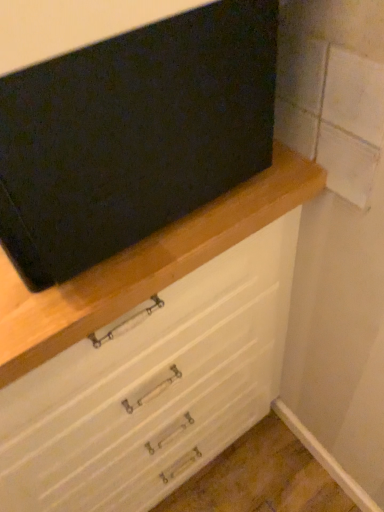
What do you see at coordinates (133, 135) in the screenshot? This screenshot has width=384, height=512. I see `white painted wood drawer at center` at bounding box center [133, 135].

What is the approximate width of white painted wood drawer at center?

The width of white painted wood drawer at center is 18.52 inches.

The width and height of the screenshot is (384, 512). What are the coordinates of `white painted wood drawer at center` in the screenshot? It's located at (133, 135).

Identify the location of white painted wood drawer at center. The width and height of the screenshot is (384, 512). (133, 135).